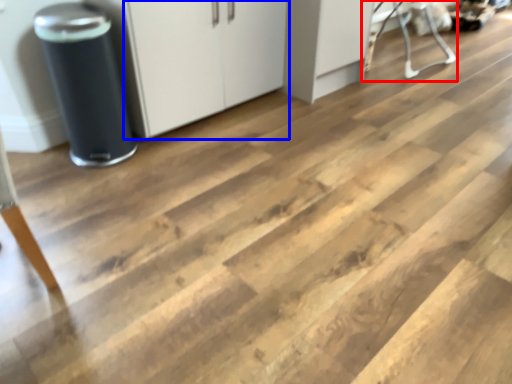
Question: Which of the following is the farthest to the observer, furniture (highlighted by a red box) or cabinetry (highlighted by a blue box)?

Choices:
 (A) furniture
 (B) cabinetry

Answer: (A)